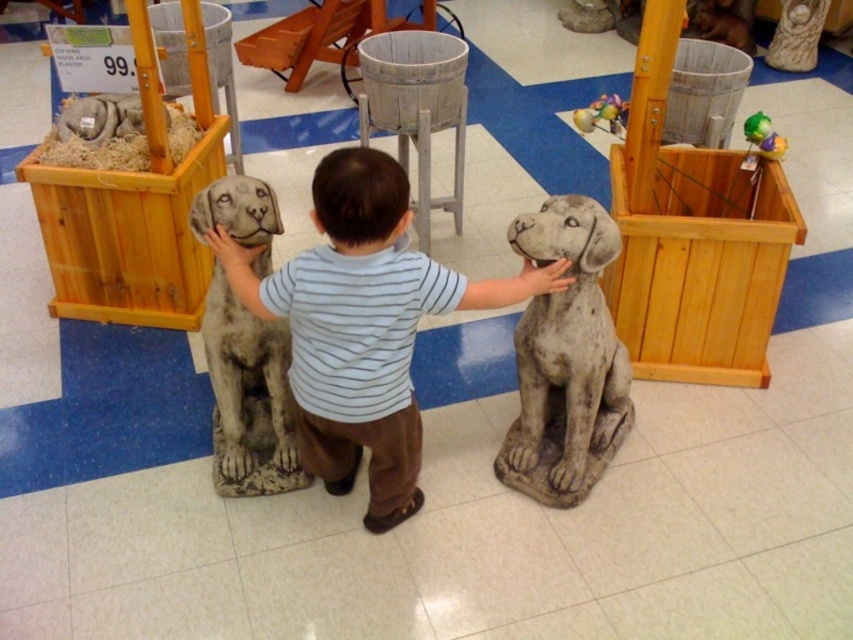
Question: Is speckled stone dog at center positioned in front of multicolored plastic ball at upper center?

Choices:
 (A) no
 (B) yes

Answer: (B)

Question: Which object is farther from the camera taking this photo?

Choices:
 (A) speckled stone dog at center
 (B) wooden crate at right

Answer: (B)

Question: Is gray stone dog at center above gray stone statue at center?

Choices:
 (A) no
 (B) yes

Answer: (A)

Question: Which of these objects is positioned farthest from the multicolored plastic ball at upper center?

Choices:
 (A) gray stone dog at center
 (B) wooden crate at left
 (C) wooden crate at right

Answer: (B)

Question: Observing the image, what is the correct spatial positioning of speckled stone dog at center in reference to gray stone statue at center?

Choices:
 (A) above
 (B) below

Answer: (B)

Question: Estimate the real-world distances between objects in this image. Which object is closer to the multicolored plastic ball at upper center?

Choices:
 (A) speckled stone dog at center
 (B) wooden crate at left
 (C) gray stone statue at center

Answer: (A)